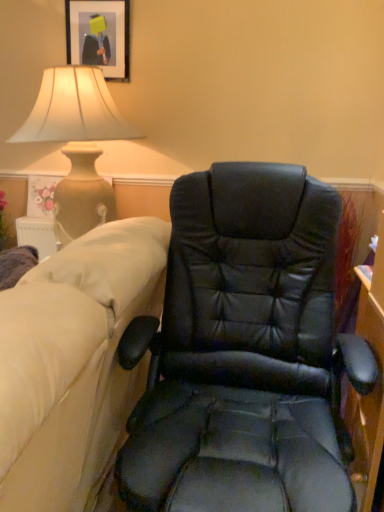
What are the coordinates of `matte black picture frame at upper left` in the screenshot? It's located at (99, 36).

What do you see at coordinates (99, 36) in the screenshot? This screenshot has width=384, height=512. I see `matte black picture frame at upper left` at bounding box center [99, 36].

This screenshot has height=512, width=384. Describe the element at coordinates (245, 353) in the screenshot. I see `black leather chair at center` at that location.

I want to click on black leather chair at center, so click(x=245, y=353).

Locate an element on the screen. Image resolution: width=384 pixels, height=512 pixels. matte black picture frame at upper left is located at coordinates (99, 36).

Is black leather chair at center to the right of matte black picture frame at upper left from the viewer's perspective?

Yes.

Is the position of black leather chair at center more distant than that of matte black picture frame at upper left?

No, it is not.

Between point (294, 382) and point (68, 3), which one is positioned behind?

Positioned behind is point (68, 3).

From the image's perspective, which object appears higher, black leather chair at center or matte black picture frame at upper left?

From the image's view, matte black picture frame at upper left is above.

From a real-world perspective, is black leather chair at center above or below matte black picture frame at upper left?

black leather chair at center is situated lower than matte black picture frame at upper left in the real world.

Looking at this image, which of these two, black leather chair at center or matte black picture frame at upper left, is wider?

black leather chair at center.

Considering the sizes of objects black leather chair at center and matte black picture frame at upper left in the image provided, who is taller, black leather chair at center or matte black picture frame at upper left?

black leather chair at center is taller.

From the picture: Can you confirm if black leather chair at center is bigger than matte black picture frame at upper left?

Indeed, black leather chair at center has a larger size compared to matte black picture frame at upper left.

Is matte black picture frame at upper left surrounded by black leather chair at center?

No.

Is black leather chair at center positioned far away from matte black picture frame at upper left?

Yes, black leather chair at center and matte black picture frame at upper left are located far from each other.

Could you tell me if black leather chair at center is turned towards matte black picture frame at upper left?

No, black leather chair at center is not aimed at matte black picture frame at upper left.

How many degrees apart are the facing directions of black leather chair at center and matte black picture frame at upper left?

The angular difference between black leather chair at center and matte black picture frame at upper left is 0.048 degrees.

In the image, there is a matte black picture frame at upper left. Where is `chair below it (from a real-world perspective)`? chair below it (from a real-world perspective) is located at coordinates (245, 353).

Is matte black picture frame at upper left at the right side of black leather chair at center?

No, matte black picture frame at upper left is not to the right of black leather chair at center.

Which is in front, matte black picture frame at upper left or black leather chair at center?

black leather chair at center is in front.

Between point (119, 53) and point (328, 323), which one is positioned behind?

The point (119, 53) is more distant.

From the image's perspective, which is above, matte black picture frame at upper left or black leather chair at center?

matte black picture frame at upper left appears higher in the image.

From a real-world perspective, which is physically above, matte black picture frame at upper left or black leather chair at center?

From a 3D spatial view, matte black picture frame at upper left is above.

Which of these two, matte black picture frame at upper left or black leather chair at center, is wider?

With larger width is black leather chair at center.

Consider the image. Does matte black picture frame at upper left have a lesser height compared to black leather chair at center?

Yes.

Does matte black picture frame at upper left have a smaller size compared to black leather chair at center?

Indeed, matte black picture frame at upper left has a smaller size compared to black leather chair at center.

In the scene shown: Would you say matte black picture frame at upper left contains black leather chair at center?

No.

Is there a large distance between matte black picture frame at upper left and black leather chair at center?

That's right, there is a large distance between matte black picture frame at upper left and black leather chair at center.

Is matte black picture frame at upper left facing towards black leather chair at center?

No, matte black picture frame at upper left is not facing towards black leather chair at center.

This screenshot has height=512, width=384. There is a black leather chair at center. What are the coordinates of `picture frame above it (from a real-world perspective)` in the screenshot? It's located at (99, 36).

Locate an element on the screen. Image resolution: width=384 pixels, height=512 pixels. chair lying below the matte black picture frame at upper left (from the image's perspective) is located at coordinates (245, 353).

At what (x,y) coordinates should I click in order to perform the action: click on chair that is under the matte black picture frame at upper left (from a real-world perspective). Please return your answer as a coordinate pair (x, y). Looking at the image, I should click on (245, 353).